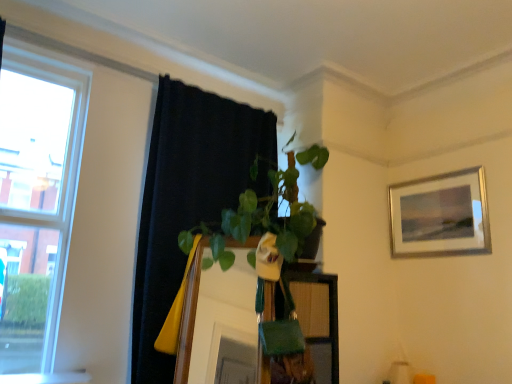
Question: From a real-world perspective, is silver metallic picture frame at upper right above or below clear glass window at left?

Choices:
 (A) above
 (B) below

Answer: (A)

Question: Is silver metallic picture frame at upper right wider or thinner than clear glass window at left?

Choices:
 (A) wide
 (B) thin

Answer: (B)

Question: Based on their relative distances, which object is nearer to the white glossy window sill at lower left?

Choices:
 (A) black fabric curtain at upper left
 (B) wooden mirror at center
 (C) clear glass window at left
 (D) silver metallic picture frame at upper right

Answer: (C)

Question: Which of these objects is positioned farthest from the silver metallic picture frame at upper right?

Choices:
 (A) clear glass window at left
 (B) black fabric curtain at upper left
 (C) white glossy window sill at lower left
 (D) wooden mirror at center

Answer: (C)